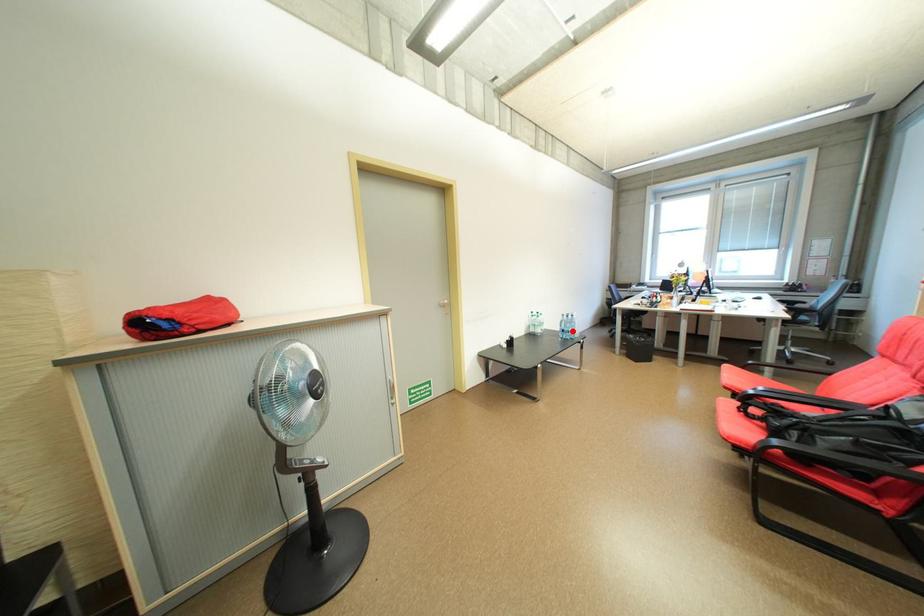
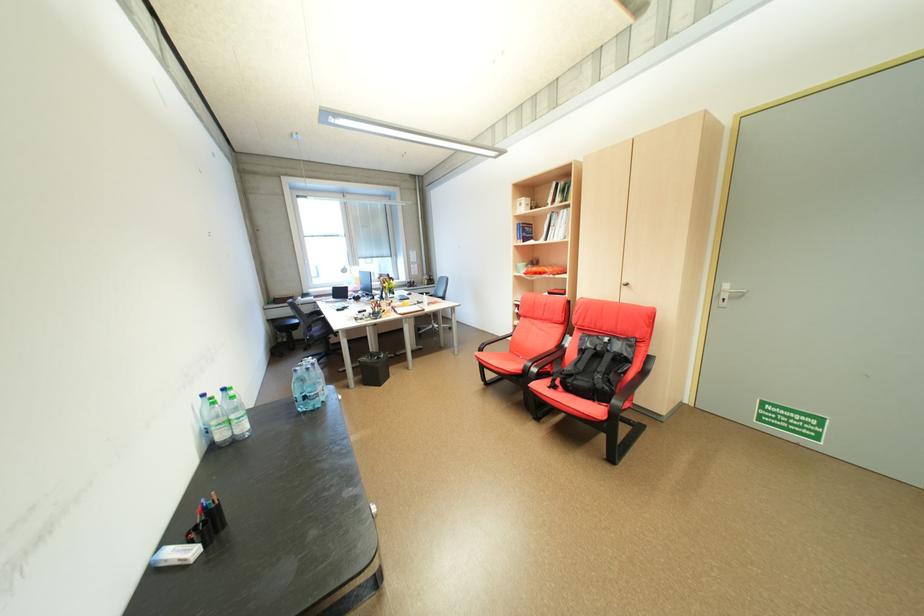
Find the pixel in the second image that matches the highlighted location in the first image.

(313, 398)